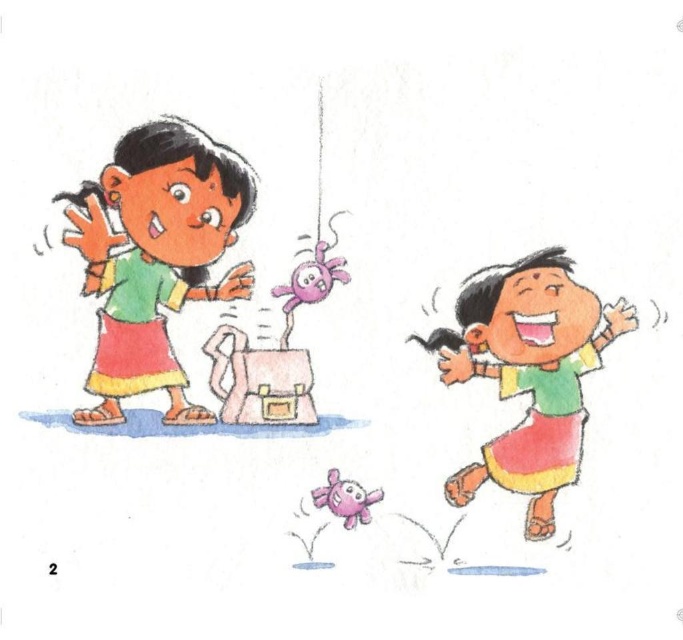
The height and width of the screenshot is (640, 683). What do you see at coordinates (529, 372) in the screenshot? I see `matte green skirt at right` at bounding box center [529, 372].

Is point (585, 358) less distant than point (322, 497)?

Yes, it is in front of point (322, 497).

The height and width of the screenshot is (640, 683). Find the location of `matte green skirt at right`. matte green skirt at right is located at coordinates (529, 372).

Which is more to the right, matte green shirt at left or matte pink plush at center?

Positioned to the right is matte pink plush at center.

I want to click on matte green shirt at left, so click(154, 257).

Locate an element on the screen. This screenshot has height=640, width=683. matte green shirt at left is located at coordinates 154,257.

Does matte green shirt at left appear under matte green skirt at right?

No.

Can you confirm if matte green shirt at left is thinner than matte green skirt at right?

Yes, matte green shirt at left is thinner than matte green skirt at right.

You are a GUI agent. You are given a task and a screenshot of the screen. Output one action in this format:
    pyautogui.click(x=<x>, y=<y>)
    Task: Click on the matte green shirt at left
    
    Given the screenshot: What is the action you would take?
    pyautogui.click(x=154, y=257)